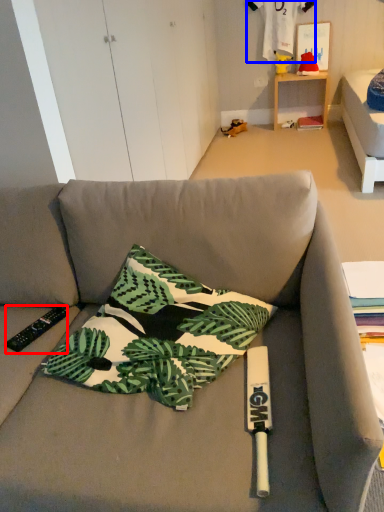
Question: Which object is further to the camera taking this photo, remote control (highlighted by a red box) or fabric (highlighted by a blue box)?

Choices:
 (A) remote control
 (B) fabric

Answer: (B)